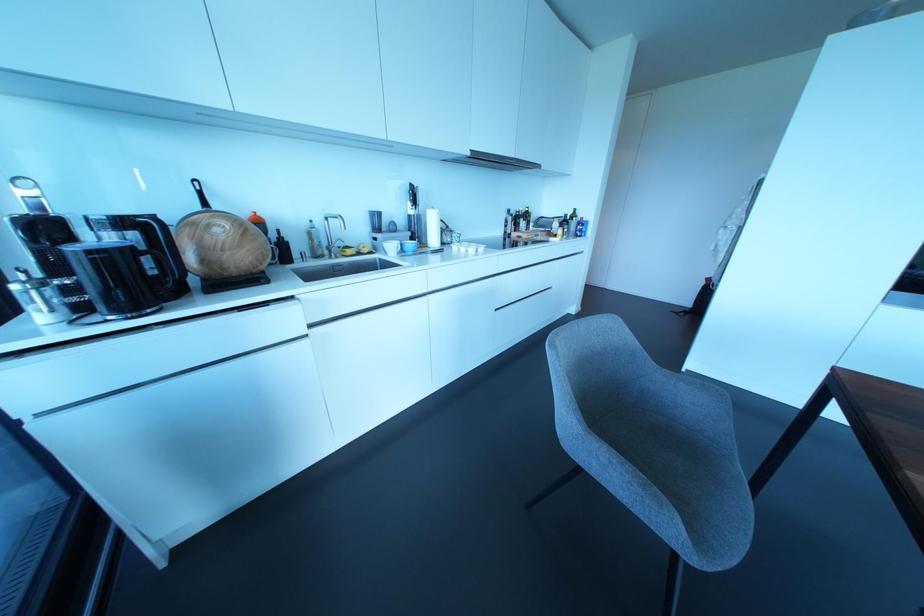
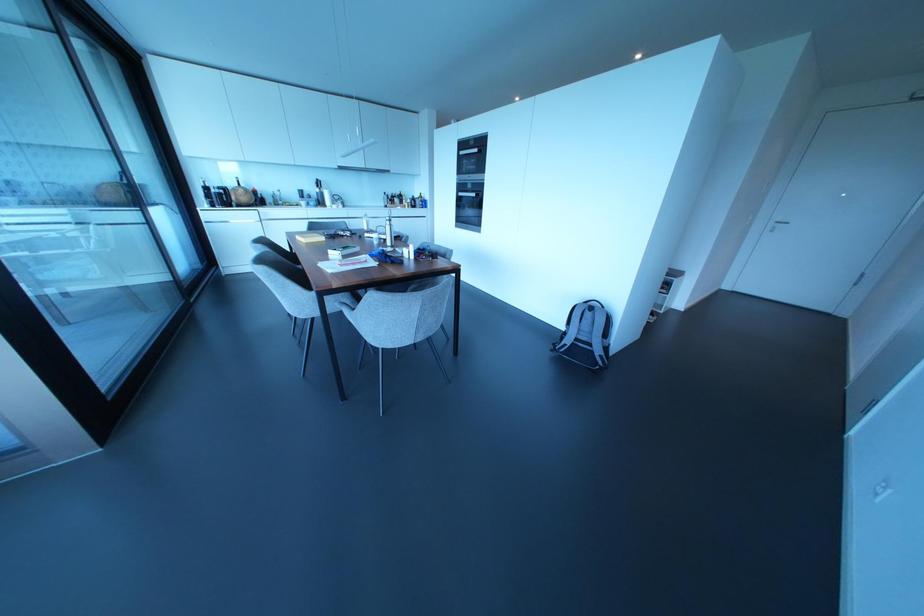
The images are taken continuously from a first-person perspective. In which direction are you moving?

The movement direction of the cameraman is right, backward.